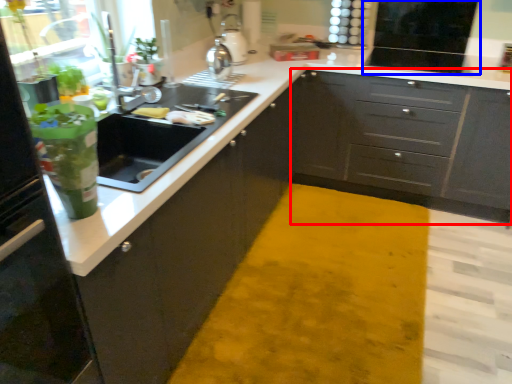
Question: Which point is further to the camera, cabinetry (highlighted by a red box) or appliance (highlighted by a blue box)?

Choices:
 (A) cabinetry
 (B) appliance

Answer: (B)